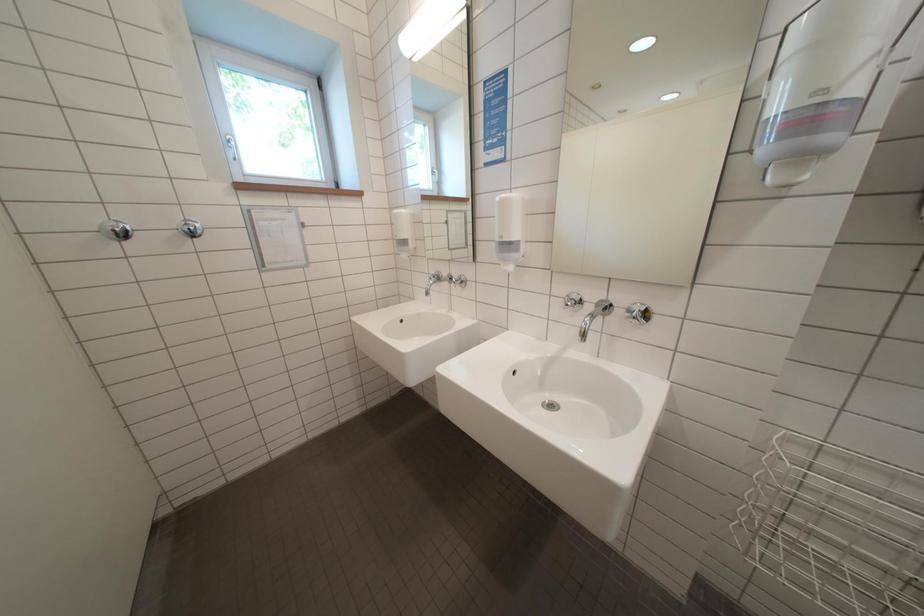
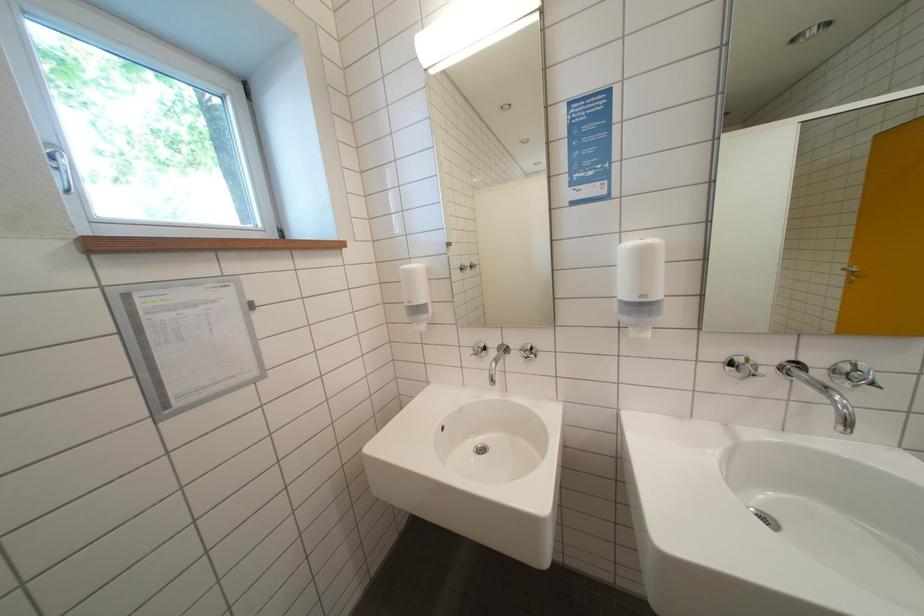
Question: The camera is either moving clockwise (left) or counter-clockwise (right) around the object. The first image is from the beginning of the video and the second image is from the end. Is the camera moving left or right when shooting the video?

Choices:
 (A) Left
 (B) Right

Answer: (A)